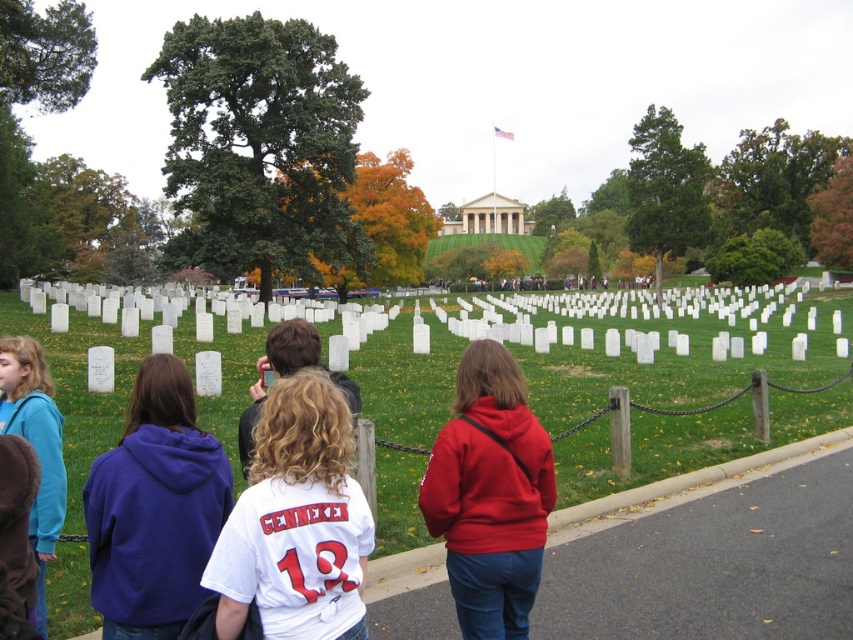
Can you confirm if white matte gravestones at center is wider than white matte t-shirt at center?

Correct, the width of white matte gravestones at center exceeds that of white matte t-shirt at center.

What do you see at coordinates (677, 364) in the screenshot? I see `white matte gravestones at center` at bounding box center [677, 364].

Between point (401, 321) and point (233, 508), which one is positioned behind?

Point (401, 321)

Where is `white matte gravestones at center`? white matte gravestones at center is located at coordinates (x=677, y=364).

Is point (662, 339) positioned in front of point (115, 620)?

No, (662, 339) is further to viewer.

Which is more to the left, white matte gravestones at center or purple hoodie at center?

Positioned to the left is purple hoodie at center.

Who is more distant from viewer, (689, 346) or (160, 588)?

Positioned behind is point (689, 346).

The height and width of the screenshot is (640, 853). I want to click on white matte gravestones at center, so click(x=677, y=364).

Does white matte t-shirt at center have a greater width compared to curly blonde hair at center?

Yes.

Which is more to the right, white matte t-shirt at center or curly blonde hair at center?

white matte t-shirt at center is more to the right.

Is point (223, 593) in front of point (283, 324)?

Yes, point (223, 593) is in front of point (283, 324).

Image resolution: width=853 pixels, height=640 pixels. In order to click on white matte t-shirt at center in this screenshot , I will do `click(296, 522)`.